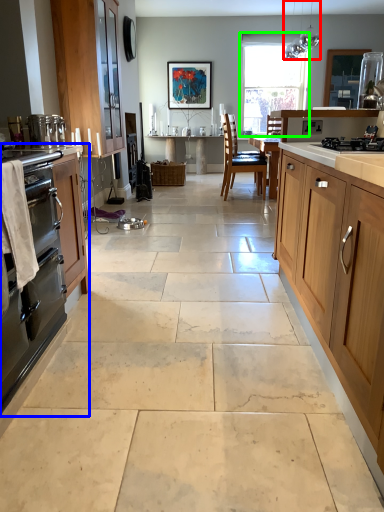
Question: Which object is positioned closest to light fixture (highlighted by a red box)? Select from cabinetry (highlighted by a blue box) and window (highlighted by a green box).

Choices:
 (A) cabinetry
 (B) window

Answer: (B)